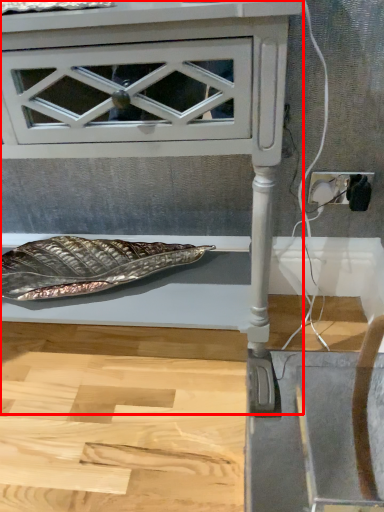
Question: In this image, where is furniture (annotated by the red box) located relative to electric outlet?

Choices:
 (A) right
 (B) left

Answer: (B)